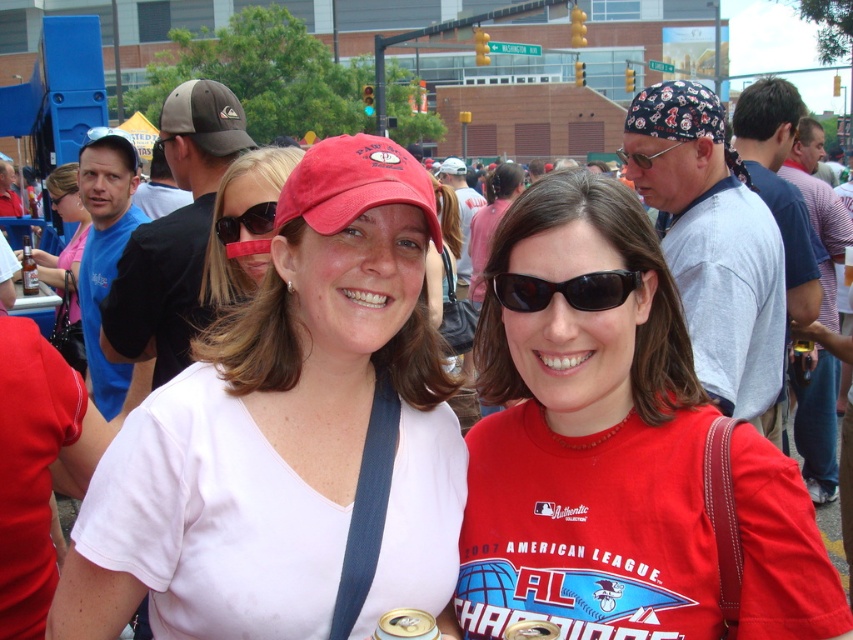
Does matte red cap at center have a lesser height compared to black plastic sunglasses at center?

Incorrect, matte red cap at center's height does not fall short of black plastic sunglasses at center's.

Which is more to the right, matte red cap at center or black plastic sunglasses at center?

black plastic sunglasses at center

Which is behind, point (271, 227) or point (622, 300)?

Point (271, 227)

The image size is (853, 640). I want to click on matte red cap at center, so click(242, 225).

Based on the photo, which is more to the left, matte black cap at upper left or gray fabric baseball cap at upper left?

matte black cap at upper left is more to the left.

Does matte black cap at upper left have a larger size compared to gray fabric baseball cap at upper left?

Indeed, matte black cap at upper left has a larger size compared to gray fabric baseball cap at upper left.

Between point (80, 234) and point (222, 90), which one is positioned in front?

Point (222, 90)

Find the location of a particular element. matte black cap at upper left is located at coordinates (65, 264).

Is point (115, 588) closer to viewer compared to point (229, 218)?

Yes.

Measure the distance between white matte shirt at center and sunglasses at center.

They are 3.75 feet apart.

The image size is (853, 640). I want to click on white matte shirt at center, so click(287, 429).

Find the location of a particular element. This screenshot has height=640, width=853. white matte shirt at center is located at coordinates (287, 429).